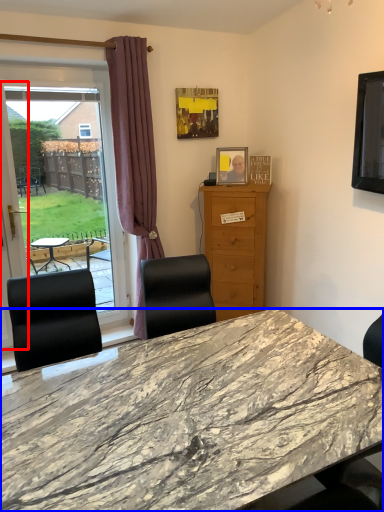
Question: Which point is closer to the camera, screen door (highlighted by a red box) or desk (highlighted by a blue box)?

Choices:
 (A) screen door
 (B) desk

Answer: (B)